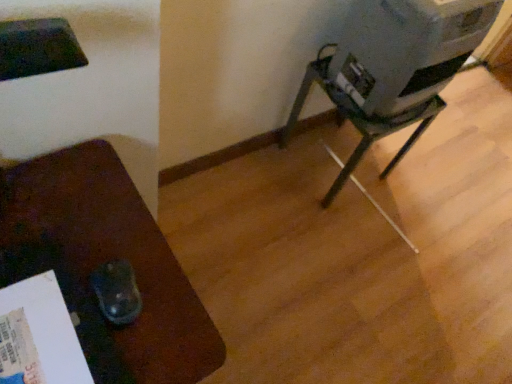
The height and width of the screenshot is (384, 512). Identify the location of vacant space underneath metallic gray projector at center-right, the 1th furniture from the top (from a real-world perspective). (333, 161).